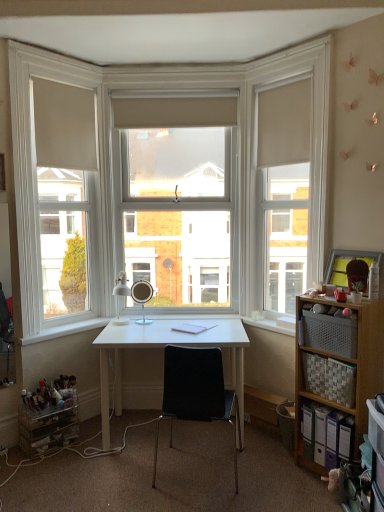
You are a GUI agent. You are given a task and a screenshot of the screen. Output one action in this format:
    pyautogui.click(x=<x>, y=<y>)
    Task: Click on the vacant space in black plastic chair at center (from a real-world perspective)
    
    Given the screenshot: What is the action you would take?
    pyautogui.click(x=188, y=474)